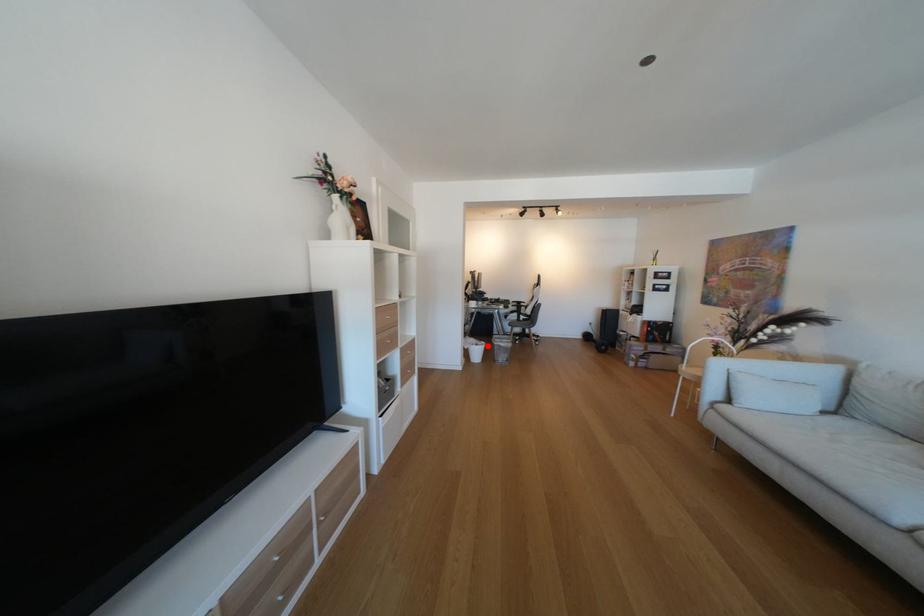
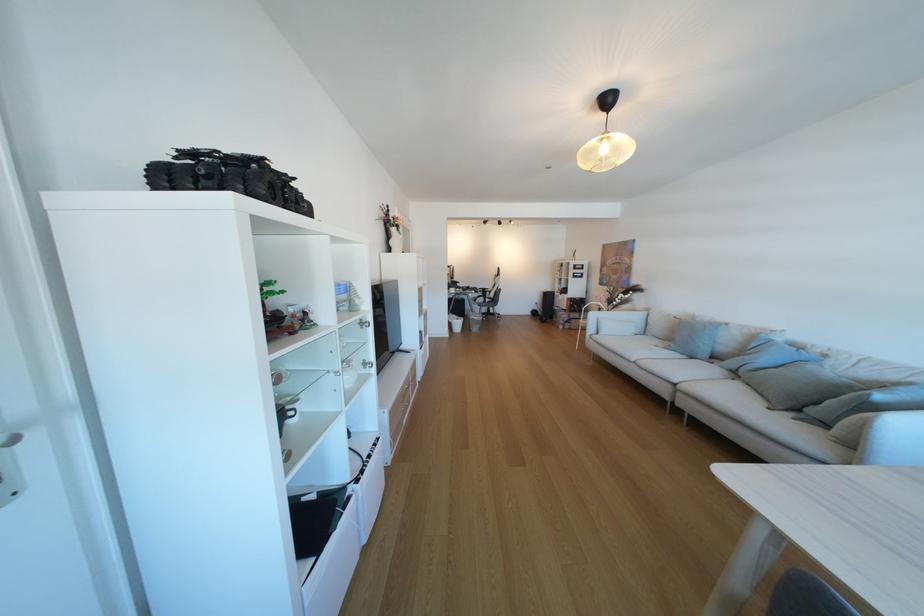
Question: I am providing you with two images of the same scene from different viewpoints. In image1, a red point is highlighted. Considering the same 3D point in image2, which of the following is correct?

Choices:
 (A) It is closer
 (B) It is farther

Answer: (A)